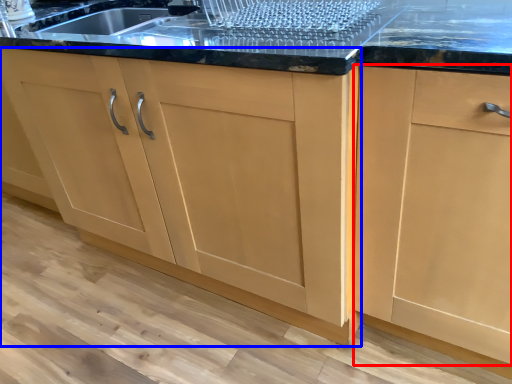
Question: Which point is further to the camera, cabinetry (highlighted by a red box) or cabinetry (highlighted by a blue box)?

Choices:
 (A) cabinetry
 (B) cabinetry

Answer: (B)